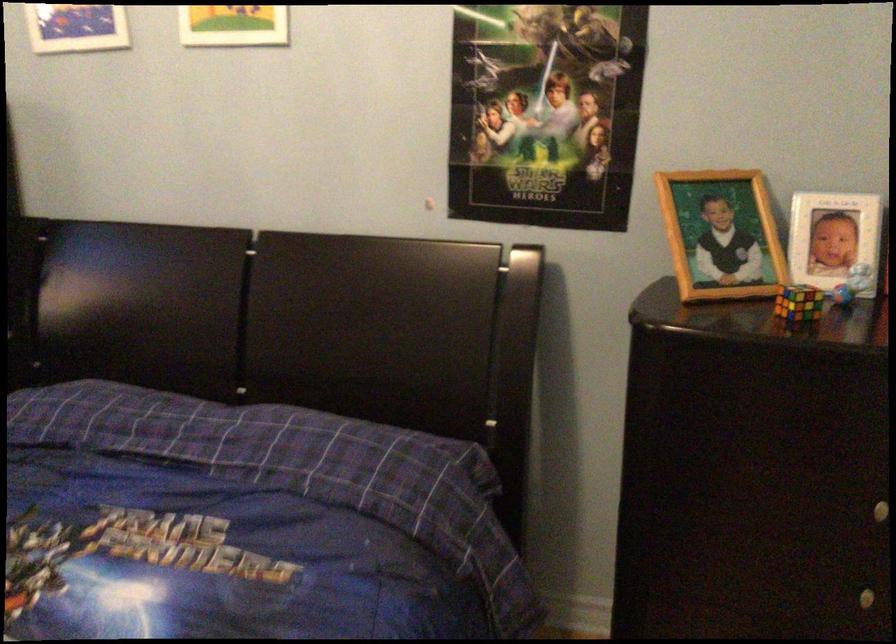
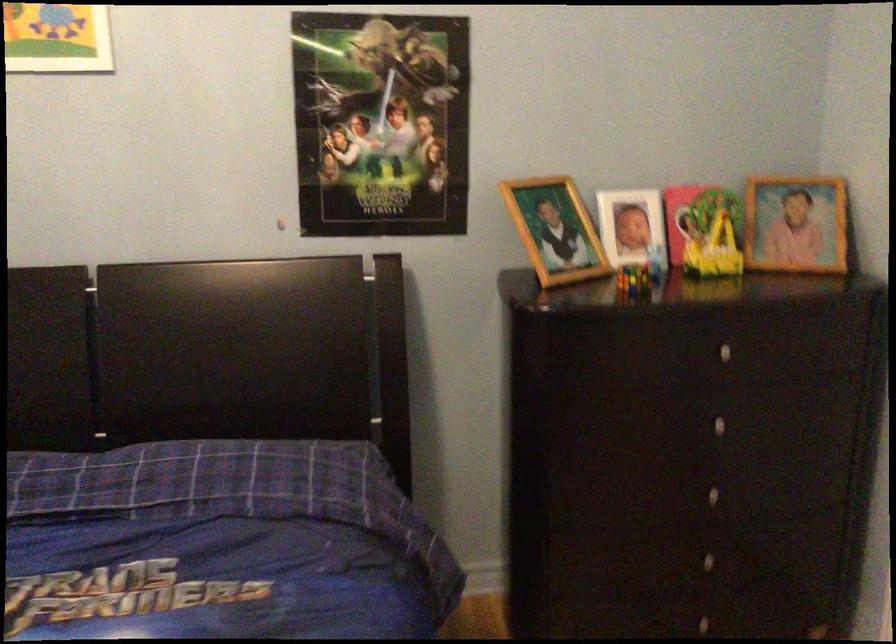
Question: What movement of the cameraman would produce the second image?

Choices:
 (A) Left
 (B) Right
 (C) Forward
 (D) Backward

Answer: (A)